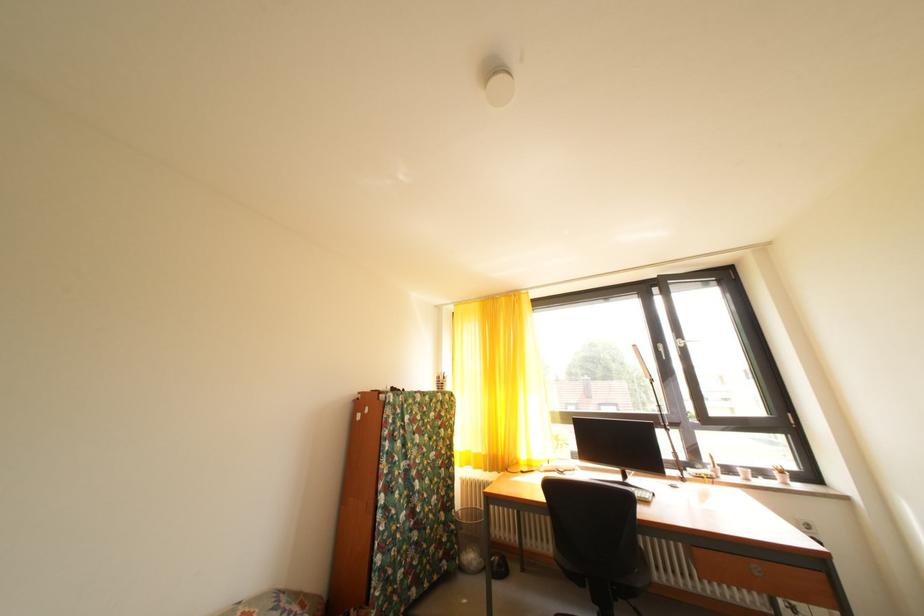
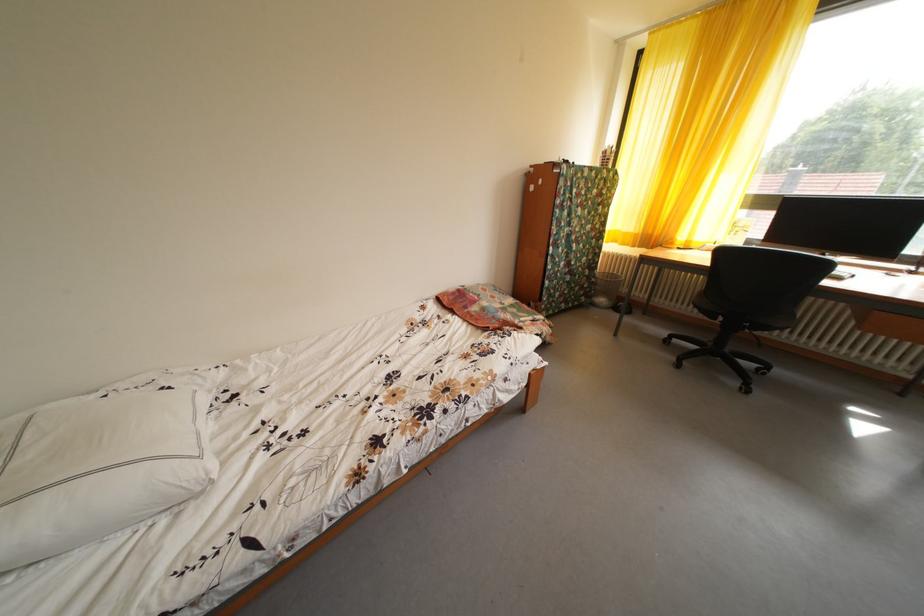
Based on the continuous images, in which direction is the camera rotating?

The rotation direction of the camera is left-down.